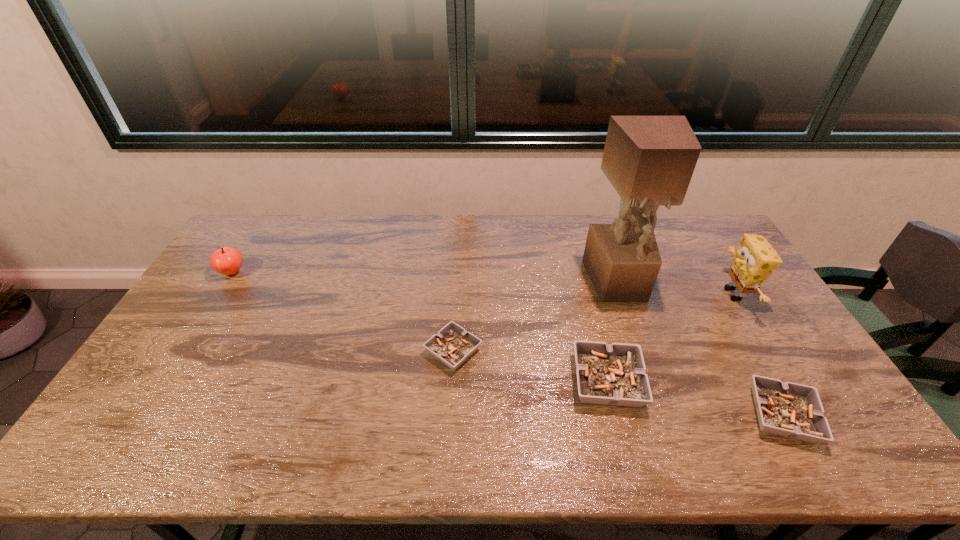
The height and width of the screenshot is (540, 960). I want to click on vacant point located between the sponge and the second shortest ashtray, so click(x=758, y=355).

This screenshot has height=540, width=960. I want to click on vacant point located between the second ashtray from left to right and the second tallest object, so click(x=670, y=338).

I want to click on vacant region between the sculpture and the shortest ashtray, so click(536, 316).

You are a GUI agent. You are given a task and a screenshot of the screen. Output one action in this format:
    pyautogui.click(x=<x>, y=<y>)
    Task: Click on the vacant space that is in between the sponge and the leftmost ashtray
    The height and width of the screenshot is (540, 960).
    Given the screenshot: What is the action you would take?
    pyautogui.click(x=593, y=323)

The width and height of the screenshot is (960, 540). I want to click on free space between the apple and the second object from left to right, so click(x=343, y=312).

This screenshot has height=540, width=960. In order to click on object that is the fifth closest one to the apple in this screenshot , I will do `click(755, 259)`.

I want to click on object that ranks as the fourth closest to the second shortest object, so click(x=452, y=345).

I want to click on ashtray that is the closest to the leftmost ashtray, so click(614, 374).

Identify which ashtray is the nearest to the rightmost ashtray. Please provide its 2D coordinates. Your answer should be formatted as a tuple, i.e. [(x, y)], where the tuple contains the x and y coordinates of a point satisfying the conditions above.

[(614, 374)]

Image resolution: width=960 pixels, height=540 pixels. In order to click on vacant space that satisfies the following two spatial constraints: 1. on the face of the fifth shortest object; 2. on the front side of the shortest object in this screenshot , I will do `click(768, 351)`.